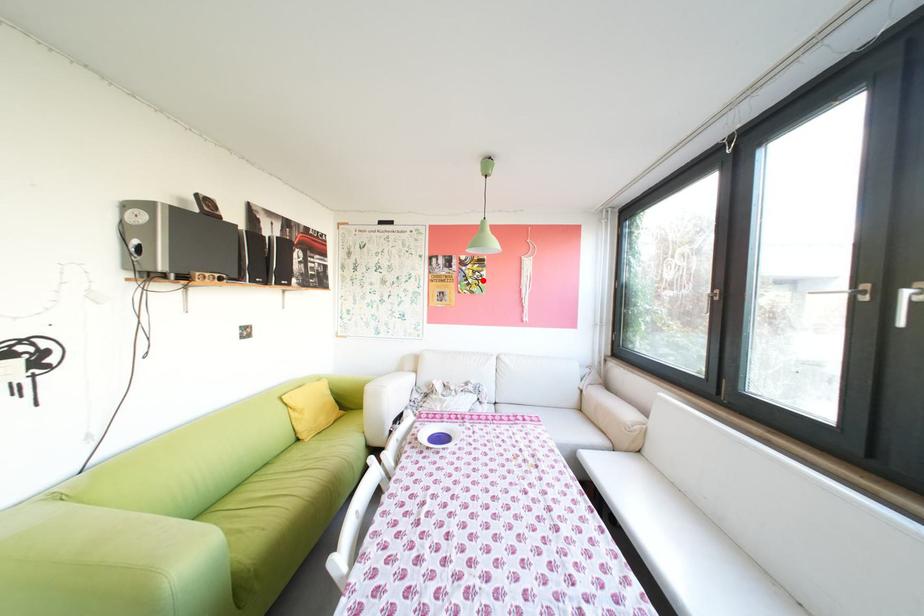
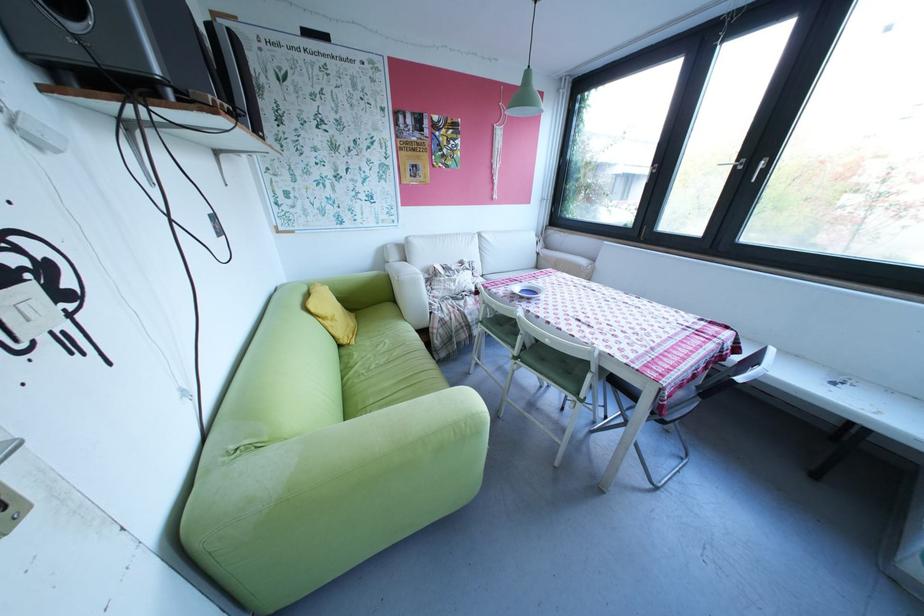
In the second image, find the point that corresponds to the highlighted location in the first image.

(457, 151)